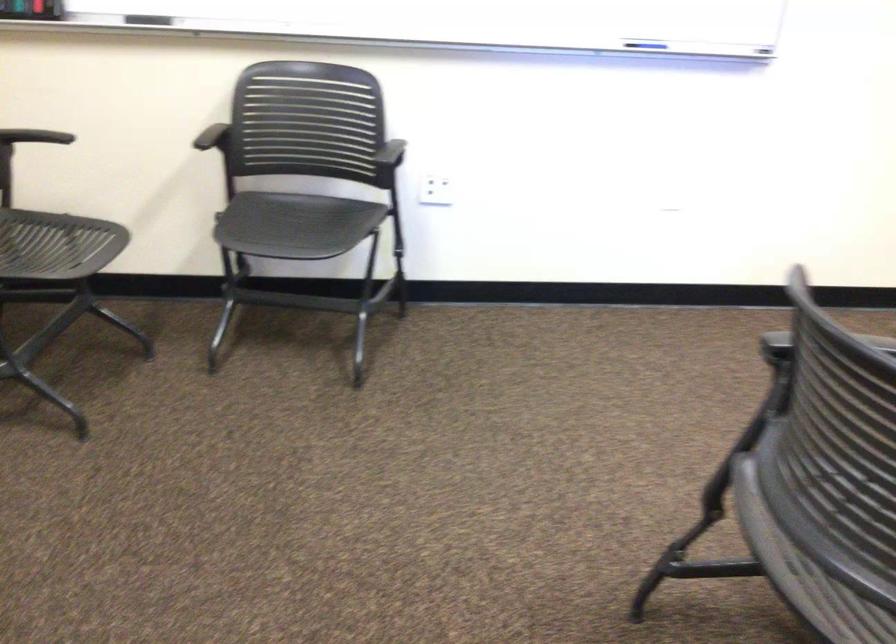
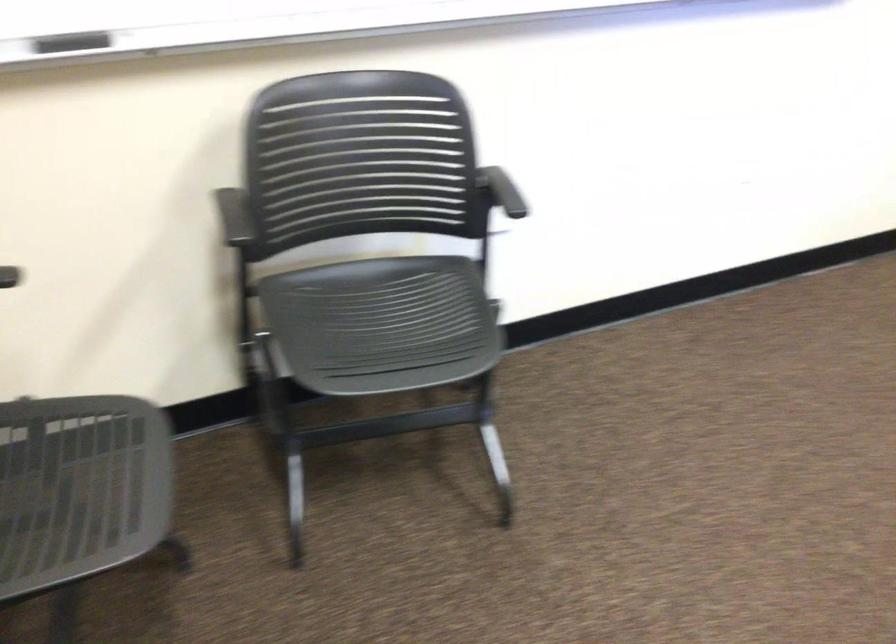
In the scene shown: In a continuous first-person perspective shot, in which direction is the camera moving?

The movement direction of the cameraman is left, forward.